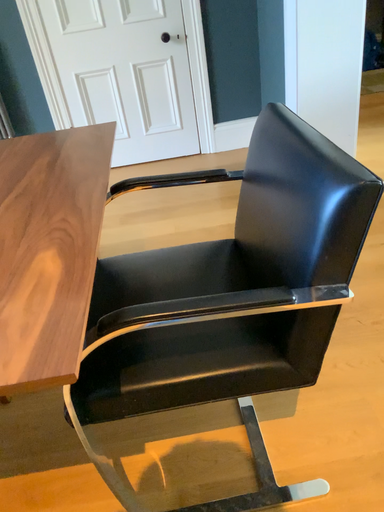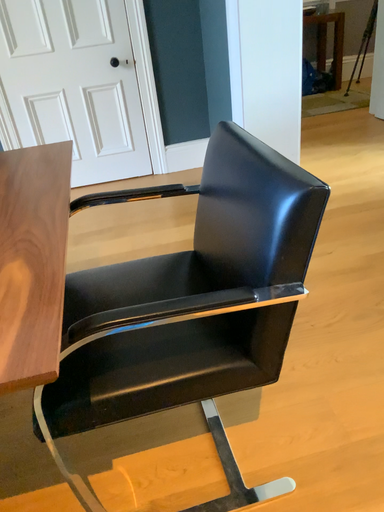
Question: How did the camera likely rotate when shooting the video?

Choices:
 (A) rotated left
 (B) rotated right

Answer: (B)